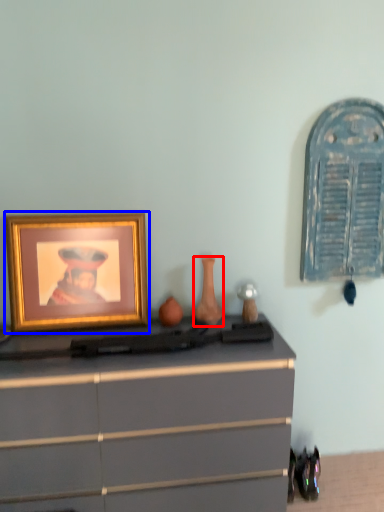
Question: Which object is closer to the camera taking this photo, vase (highlighted by a red box) or picture frame (highlighted by a blue box)?

Choices:
 (A) vase
 (B) picture frame

Answer: (B)